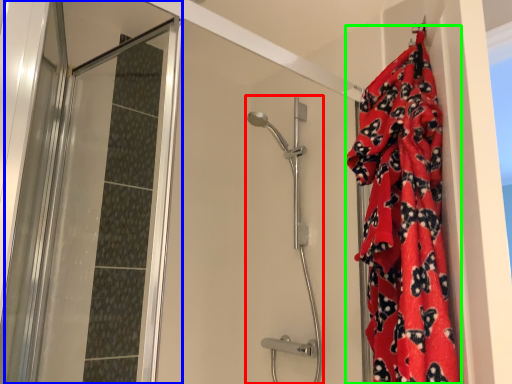
Question: Which object is positioned farthest from shower door (highlighted by a red box)? Select from screen door (highlighted by a blue box) and blanket (highlighted by a green box).

Choices:
 (A) screen door
 (B) blanket

Answer: (B)